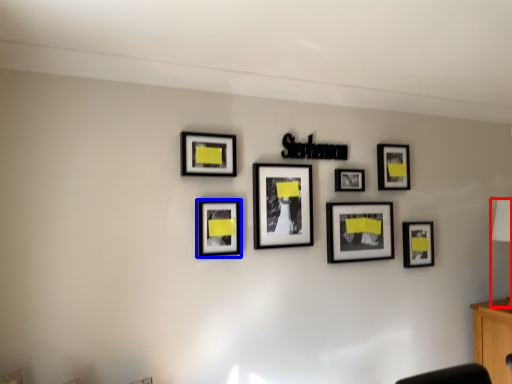
Question: Which object appears closest to the camera in this image, table lamp (highlighted by a red box) or picture frame (highlighted by a blue box)?

Choices:
 (A) table lamp
 (B) picture frame

Answer: (B)